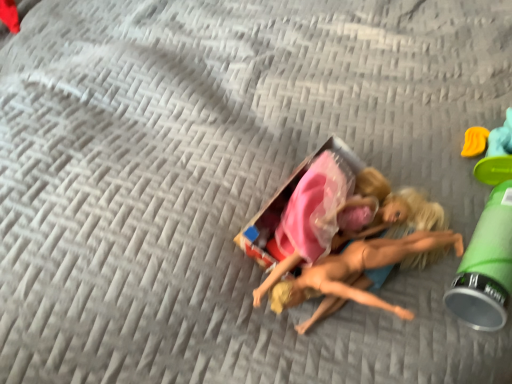
The width and height of the screenshot is (512, 384). In order to click on green plastic cup at lower right in this screenshot , I will do point(488,244).

This screenshot has height=384, width=512. What do you see at coordinates (488, 244) in the screenshot? I see `green plastic cup at lower right` at bounding box center [488, 244].

Identify the location of green plastic cup at lower right. (488, 244).